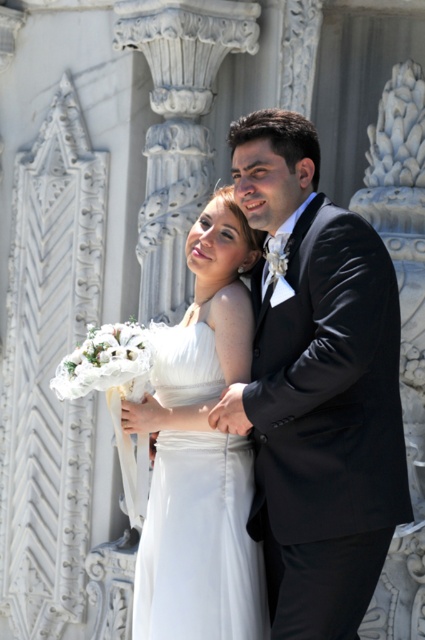
Can you confirm if shiny black suit at center is bigger than white satin dress at center?

Incorrect, shiny black suit at center is not larger than white satin dress at center.

Can you confirm if shiny black suit at center is positioned to the left of white satin dress at center?

Incorrect, shiny black suit at center is not on the left side of white satin dress at center.

Describe the element at coordinates (317, 387) in the screenshot. I see `shiny black suit at center` at that location.

You are a GUI agent. You are given a task and a screenshot of the screen. Output one action in this format:
    pyautogui.click(x=<x>, y=<y>)
    Task: Click on the shiny black suit at center
    The height and width of the screenshot is (640, 425).
    Given the screenshot: What is the action you would take?
    pyautogui.click(x=317, y=387)